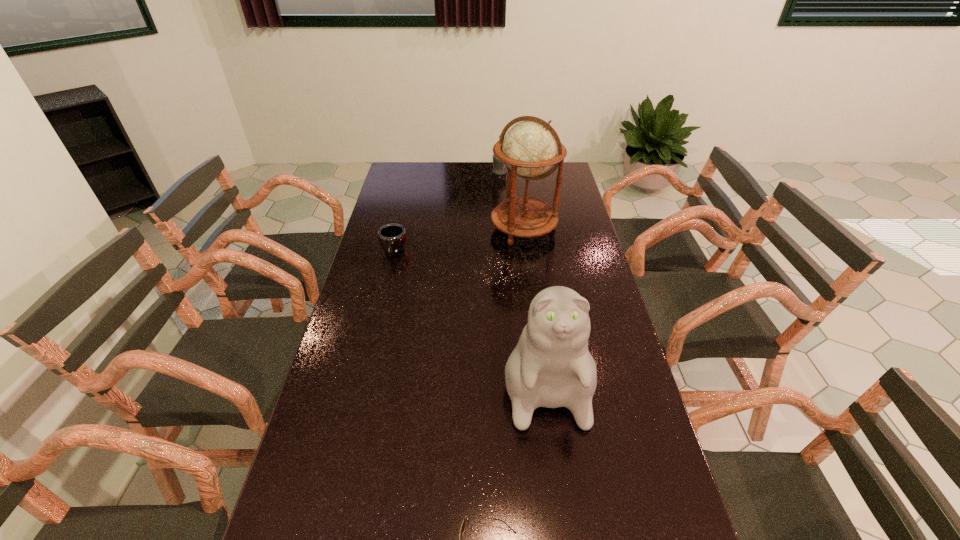
I want to click on globe, so click(529, 149).

Where is `cat`? cat is located at coordinates (551, 367).

Identify the location of the fourth shortest object. (551, 367).

Where is `vodka`? The image size is (960, 540). vodka is located at coordinates (499, 168).

You are a GUI agent. You are given a task and a screenshot of the screen. Output one action in this format:
    pyautogui.click(x=<x>, y=<y>)
    Task: Click on the farthest object
    
    Given the screenshot: What is the action you would take?
    pyautogui.click(x=499, y=168)

I want to click on the second shortest object, so click(x=392, y=237).

The width and height of the screenshot is (960, 540). Identify the location of the leftmost object. pos(392,237).

Find the location of a particular element. This screenshot has width=960, height=540. vacant space located on the surface of the globe is located at coordinates (530, 279).

This screenshot has width=960, height=540. I want to click on vacant space situated 0.060m on the face of the second tallest object, so click(557, 457).

Image resolution: width=960 pixels, height=540 pixels. Identify the location of free space located on the front label of the third tallest object. (444, 172).